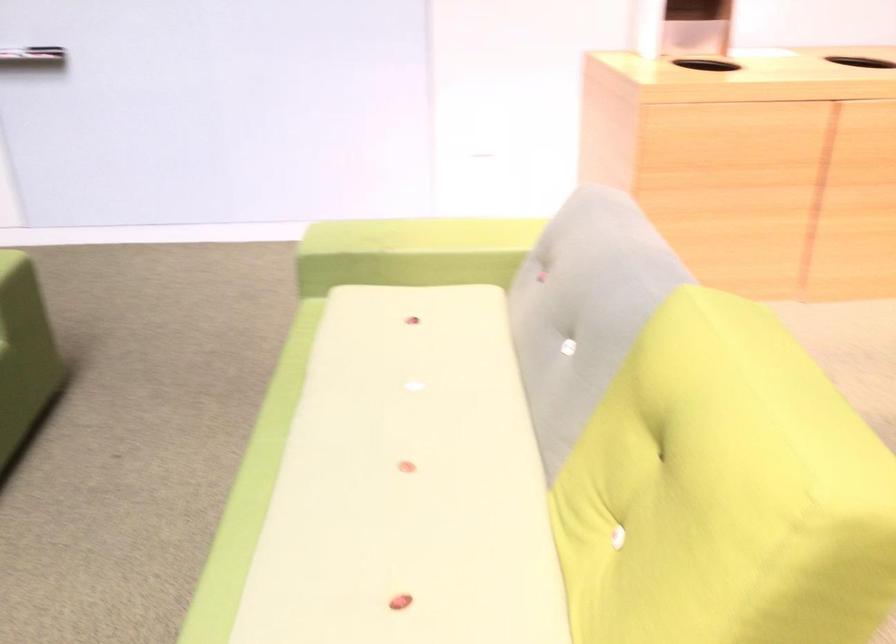
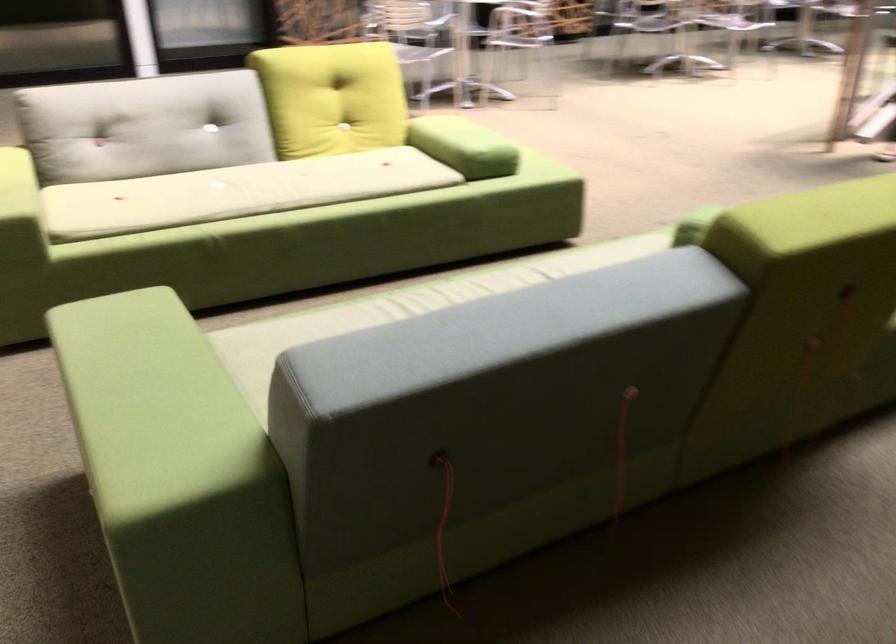
Find the pixel in the second image that matches pixel 352 390 in the first image.

(236, 192)